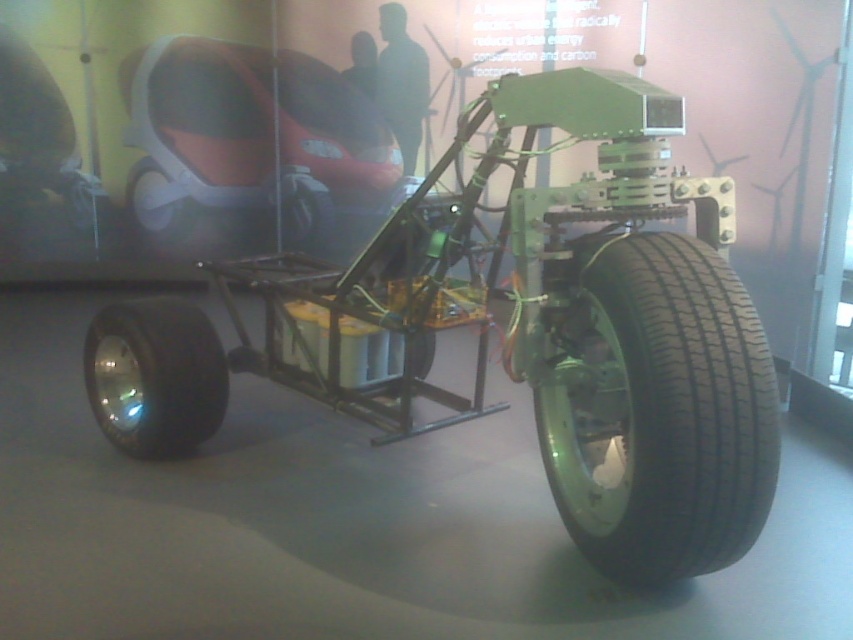
Question: Estimate the real-world distances between objects in this image. Which object is farther from the metallic silver wheel at center?

Choices:
 (A) black rubber tire at lower right
 (B) black rubber tire at lower left
 (C) green metallic frame at center
 (D) black rubber wheel at center

Answer: (A)

Question: Is metallic silver wheel at center smaller than black rubber tire at center?

Choices:
 (A) no
 (B) yes

Answer: (A)

Question: Does black rubber tire at lower left come behind black rubber wheel at center?

Choices:
 (A) yes
 (B) no

Answer: (B)

Question: Which object is the farthest from the green metallic frame at center?

Choices:
 (A) metallic silver wheel at center
 (B) black rubber tire at lower left
 (C) black rubber tire at lower right

Answer: (A)

Question: Which object is closer to the camera taking this photo?

Choices:
 (A) green metallic frame at center
 (B) black rubber wheel at center
 (C) black rubber tire at lower left

Answer: (A)

Question: Is green metallic frame at center above black rubber wheel at center?

Choices:
 (A) yes
 (B) no

Answer: (B)